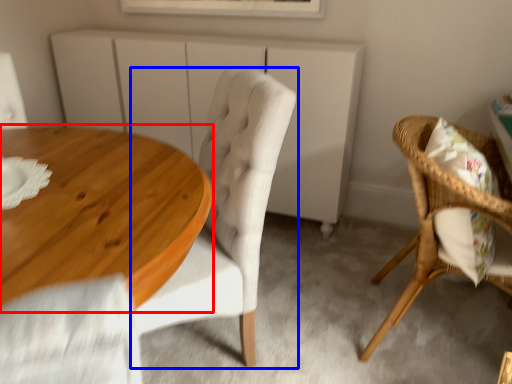
Question: Which of the following is the closest to the observer, coffee table (highlighted by a red box) or chair (highlighted by a blue box)?

Choices:
 (A) coffee table
 (B) chair

Answer: (A)